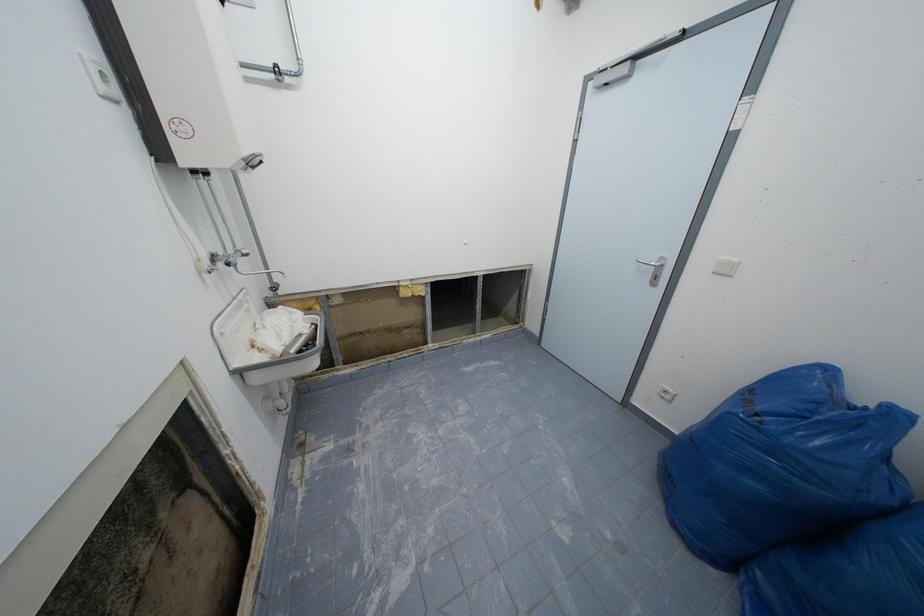
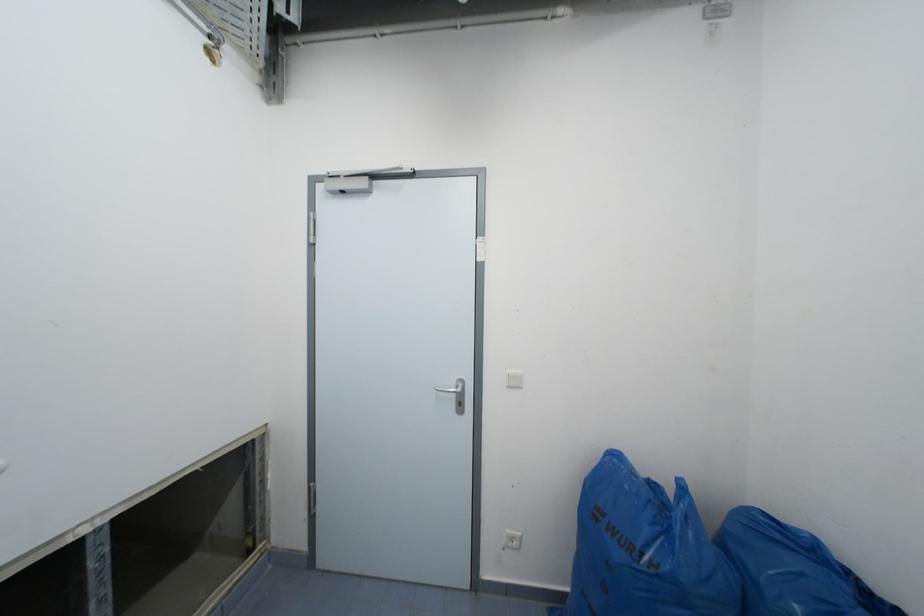
Question: How did the camera likely rotate?

Choices:
 (A) Left
 (B) Right
 (C) Up
 (D) Down

Answer: (B)